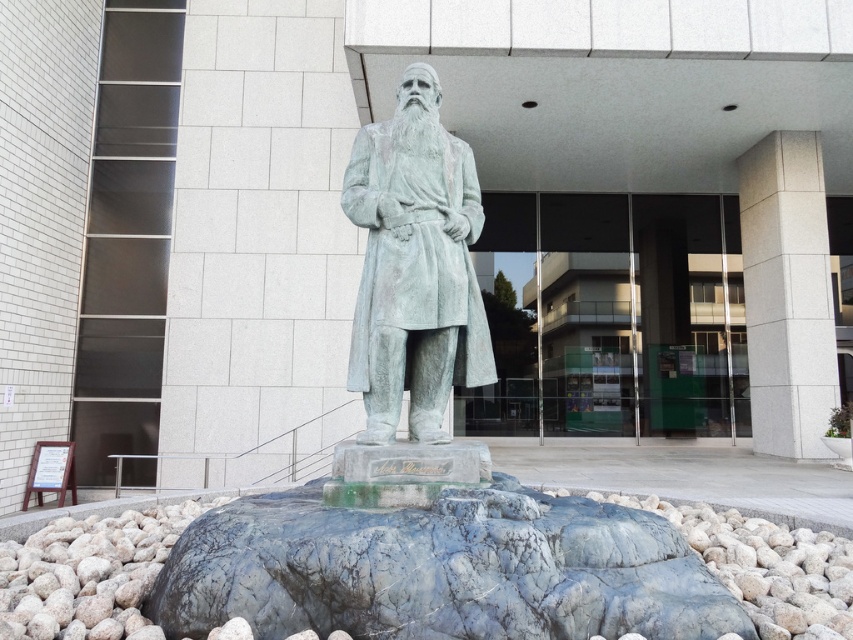
You are standing at the entrance of the building and want to locate the green marble fountain at center. According to the coordinates provided, in which direction should you walk to reach it?

The green marble fountain at center is located at coordinates point (428, 464). Since you are at the entrance, you should walk towards the center of the image to reach it.

Looking at this image, you are standing in front of the statue and want to place two markers at the coordinates point [413,625] and point [424,403]. Which marker will be closer to your current position?

Point [413,625] is closer to the viewer than point [424,403], so the marker at point [413,625] will be closer to your current position.